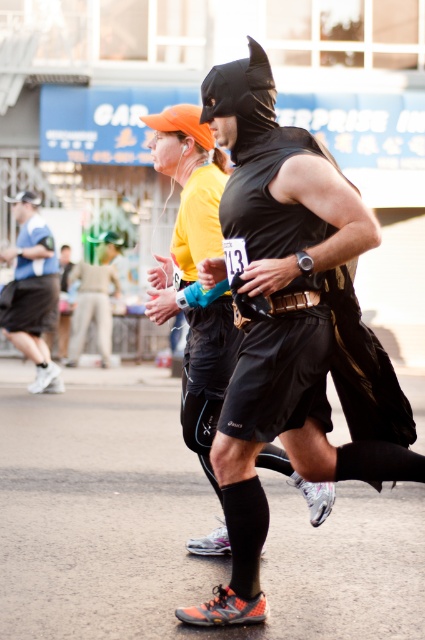
Can you confirm if matte black costume at center is bigger than black matte vest at center?

Yes.

Between matte black costume at center and black matte vest at center, which one is positioned higher?

black matte vest at center is above.

You are a GUI agent. You are given a task and a screenshot of the screen. Output one action in this format:
    pyautogui.click(x=<x>, y=<y>)
    Task: Click on the matte black costume at center
    Image resolution: width=425 pixels, height=640 pixels.
    Given the screenshot: What is the action you would take?
    pyautogui.click(x=289, y=324)

What do you see at coordinates (186, 200) in the screenshot?
I see `black matte vest at center` at bounding box center [186, 200].

Can you confirm if black matte vest at center is smaller than matte blue shirt at left?

Yes.

Is point (201, 426) closer to viewer compared to point (42, 358)?

Yes, it is.

Identify the location of black matte vest at center. (186, 200).

Where is `matte black costume at center`? The width and height of the screenshot is (425, 640). matte black costume at center is located at coordinates (289, 324).

Can you confirm if matte black costume at center is positioned above matte blue shirt at left?

Incorrect, matte black costume at center is not positioned above matte blue shirt at left.

Is point (354, 364) positioned behind point (50, 368)?

No, it is in front of (50, 368).

Locate an element on the screen. matte black costume at center is located at coordinates (289, 324).